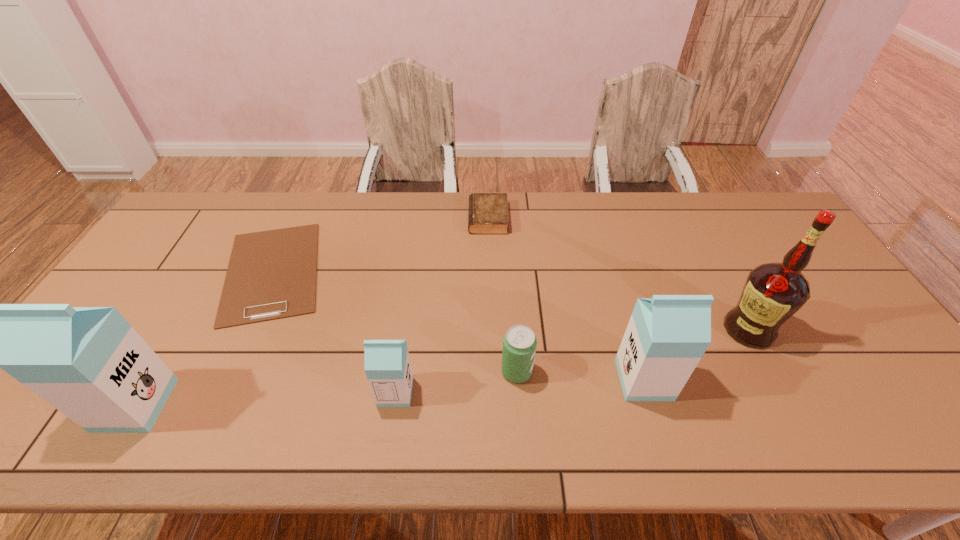
Locate an element on the screen. The width and height of the screenshot is (960, 540). diary located at the far edge is located at coordinates (488, 214).

You are a GUI agent. You are given a task and a screenshot of the screen. Output one action in this format:
    pyautogui.click(x=<x>, y=<y>)
    Task: Click on the clipboard that is at the far edge
    Image resolution: width=960 pixels, height=540 pixels.
    Given the screenshot: What is the action you would take?
    pyautogui.click(x=272, y=274)

The image size is (960, 540). Find the location of `soda located at the near edge`. soda located at the near edge is located at coordinates (519, 344).

Find the location of `free point at the far edge`. free point at the far edge is located at coordinates (253, 217).

Identify the location of vacant space at the near edge of the desktop. The height and width of the screenshot is (540, 960). (816, 394).

Locate an element on the screen. Image resolution: width=960 pixels, height=540 pixels. vacant space at the right edge of the desktop is located at coordinates (812, 287).

You are a GUI agent. You are given a task and a screenshot of the screen. Output one action in this format:
    pyautogui.click(x=<x>, y=<y>)
    Task: Click on the vacant space at the far left corner
    Image resolution: width=960 pixels, height=540 pixels.
    Given the screenshot: What is the action you would take?
    pyautogui.click(x=217, y=226)

Identify the location of blank space at the far right corner of the desktop. (783, 227).

Identify the location of free area in between the soda and the leftmost milk carton. The width and height of the screenshot is (960, 540). (326, 388).

I want to click on free spot between the shortest object and the fourth tallest object, so click(334, 332).